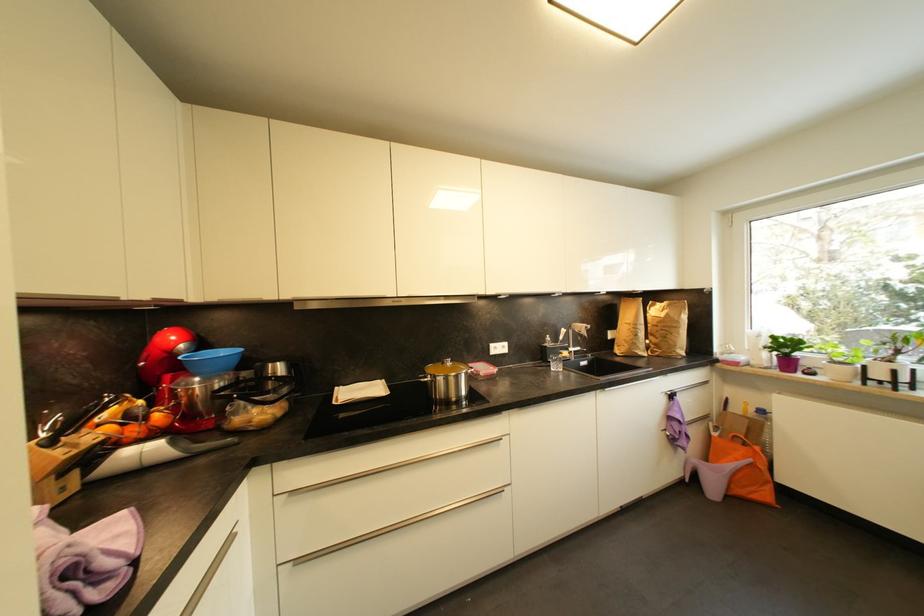
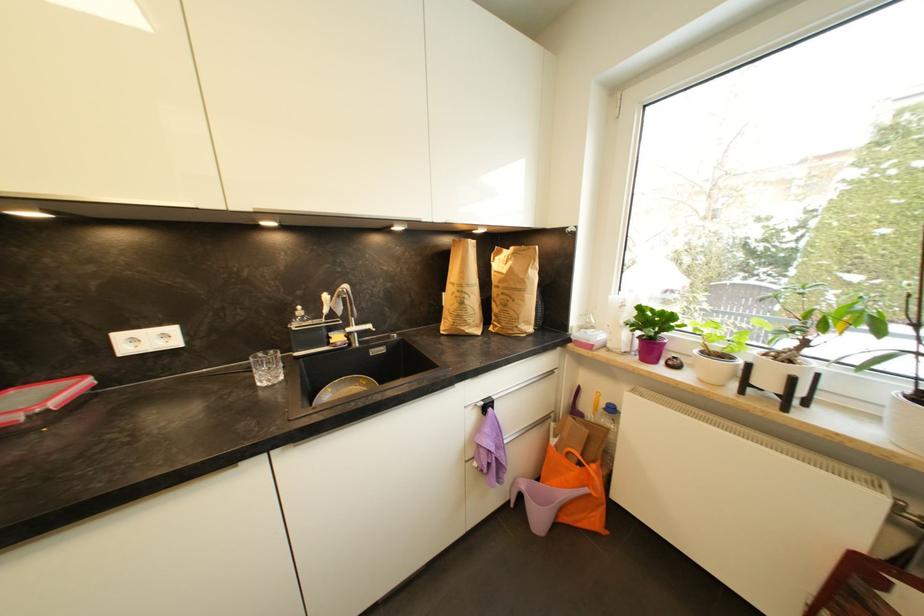
From the picture: Which direction would the cameraman need to move to produce the second image?

The cameraman moved toward right, forward.